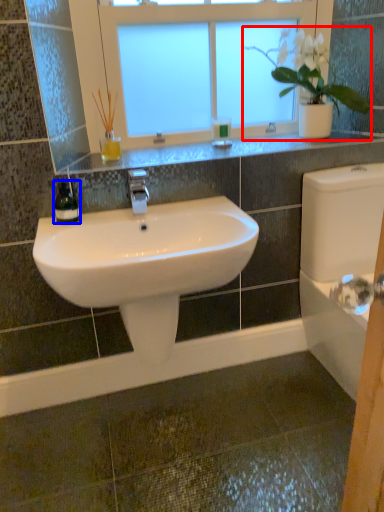
Question: Which point is further to the camera, houseplant (highlighted by a red box) or soap dispenser (highlighted by a blue box)?

Choices:
 (A) houseplant
 (B) soap dispenser

Answer: (A)